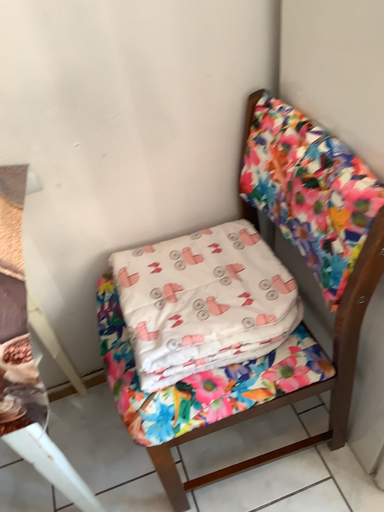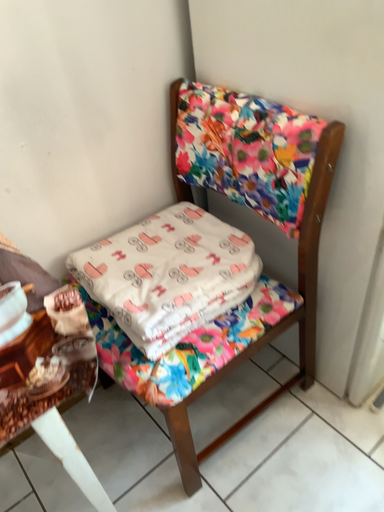
Question: Which way did the camera rotate in the video?

Choices:
 (A) rotated right
 (B) rotated left

Answer: (A)